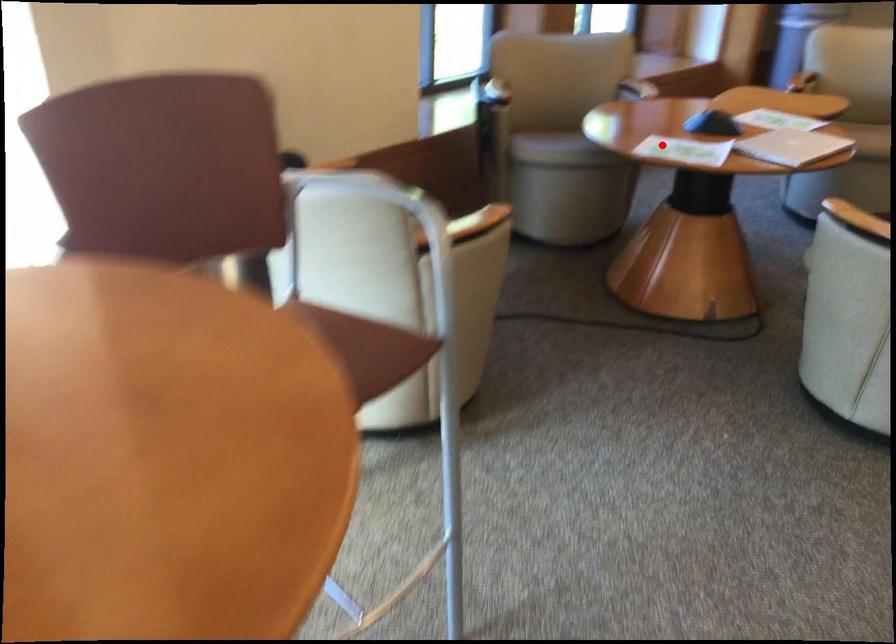
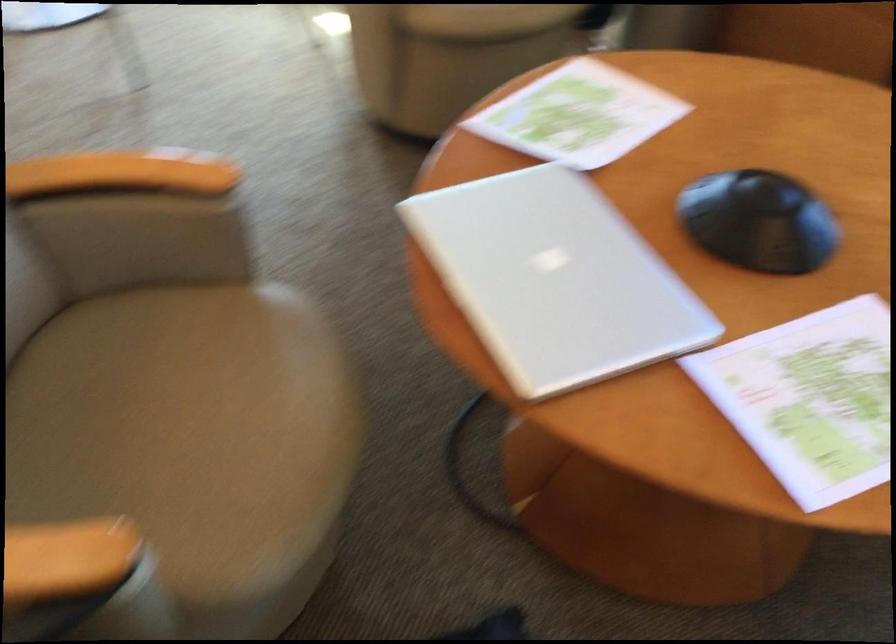
Question: I am providing you with two images of the same scene from different viewpoints. In image1, a red point is highlighted. Considering the same 3D point in image2, which of the following is correct?

Choices:
 (A) It is closer
 (B) It is farther

Answer: (A)